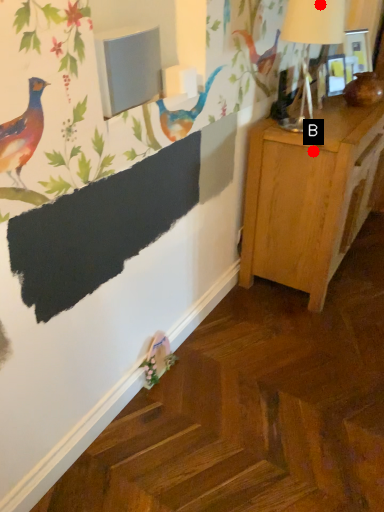
Question: Two points are circled on the image, labeled by A and B beside each circle. Among these points, which one is nearest to the camera?

Choices:
 (A) A is closer
 (B) B is closer

Answer: (A)